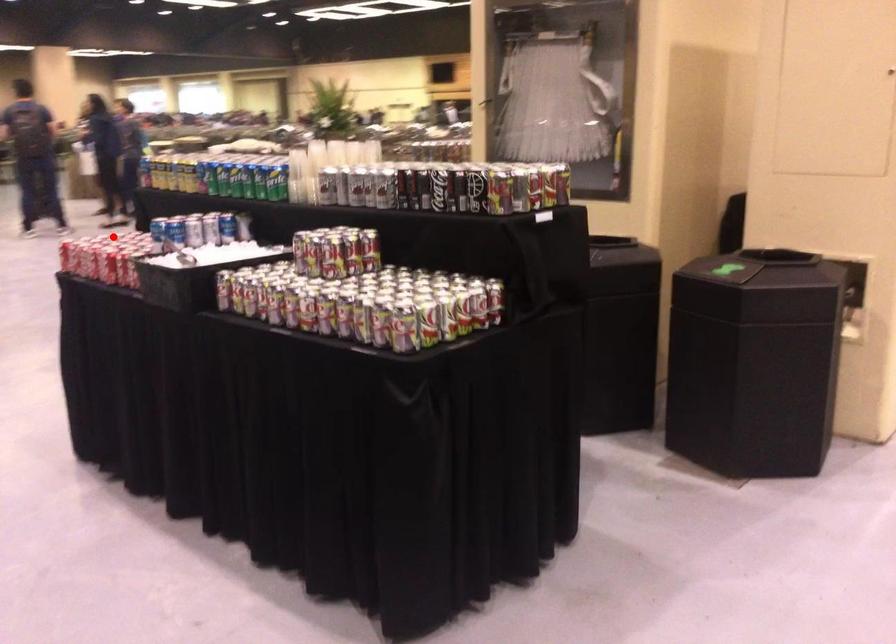
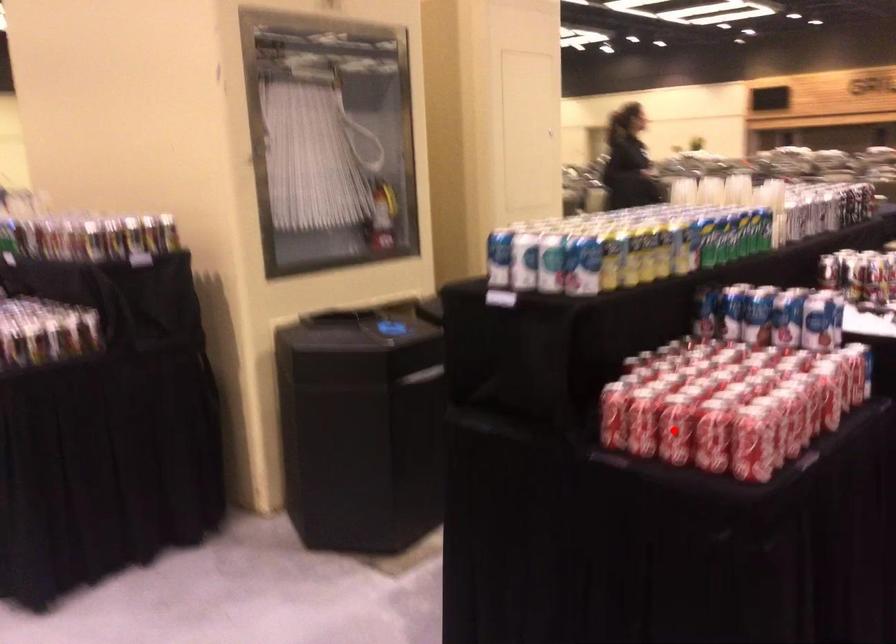
I am providing you with two images of the same scene from different viewpoints. A red point is marked on the first image and another point is marked on the second image. Does the point marked in image1 correspond to the same location as the one in image2?

No